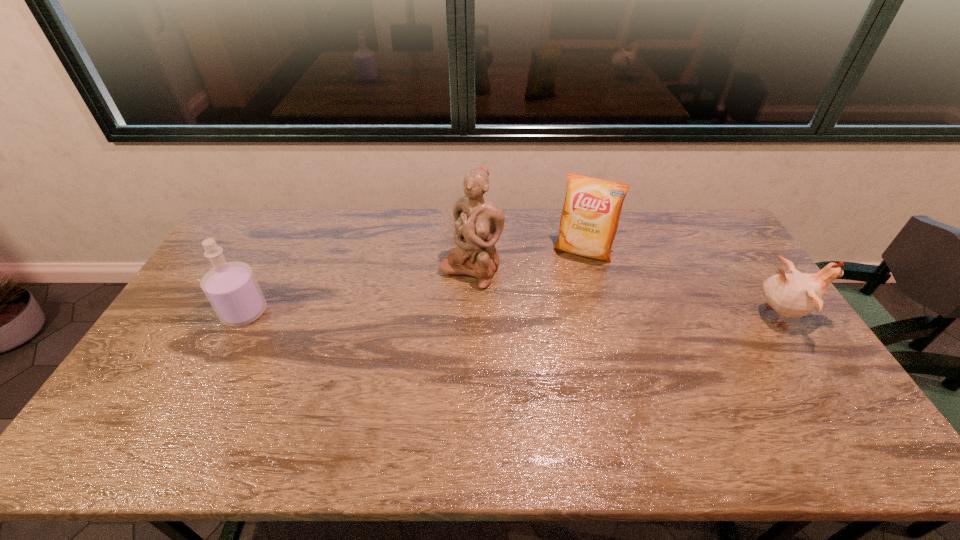
Identify the location of perfume. Image resolution: width=960 pixels, height=540 pixels. (231, 287).

Locate an element on the screen. bird is located at coordinates (795, 295).

This screenshot has width=960, height=540. Identify the location of the shortest object. (795, 295).

Image resolution: width=960 pixels, height=540 pixels. Identify the location of crisp (potato chip). (590, 216).

Locate an element on the screen. the tallest object is located at coordinates click(x=479, y=223).

Where is `the third object from right to left`? This screenshot has height=540, width=960. the third object from right to left is located at coordinates [x=479, y=223].

Locate an element on the screen. vacant area located on the back of the leftmost object is located at coordinates (270, 265).

Find the location of `vacant space located on the front-facing side of the third object from left to right`. vacant space located on the front-facing side of the third object from left to right is located at coordinates (554, 323).

At what (x,y) coordinates should I click in order to perform the action: click on free region located on the front-facing side of the third object from left to right. Please return your answer as a coordinate pair (x, y). The height and width of the screenshot is (540, 960). Looking at the image, I should click on (544, 348).

Locate an element on the screen. Image resolution: width=960 pixels, height=540 pixels. vacant region located on the front-facing side of the third object from left to right is located at coordinates (558, 314).